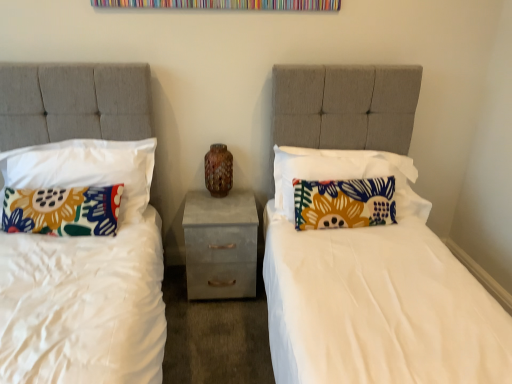
Question: Does brown speckled vase at center have a lesser height compared to floral fabric pillow at left, which is the 3th pillow from right to left?

Choices:
 (A) no
 (B) yes

Answer: (B)

Question: Is brown speckled vase at center taller than floral fabric pillow at left, which is the 3th pillow from right to left?

Choices:
 (A) yes
 (B) no

Answer: (B)

Question: From a real-world perspective, is brown speckled vase at center on top of floral fabric pillow at left, the second pillow viewed from the left?

Choices:
 (A) no
 (B) yes

Answer: (A)

Question: Is brown speckled vase at center oriented towards floral fabric pillow at left, the second pillow viewed from the left?

Choices:
 (A) no
 (B) yes

Answer: (A)

Question: Is brown speckled vase at center bigger than floral fabric pillow at left, which is the 3th pillow from right to left?

Choices:
 (A) no
 (B) yes

Answer: (A)

Question: Is brown speckled vase at center smaller than floral fabric pillow at left, the second pillow viewed from the left?

Choices:
 (A) yes
 (B) no

Answer: (A)

Question: Can you confirm if floral fabric pillow at right, the fourth pillow in the left-to-right sequence, is smaller than brown speckled vase at center?

Choices:
 (A) no
 (B) yes

Answer: (A)

Question: Does floral fabric pillow at right, the fourth pillow in the left-to-right sequence, have a greater width compared to brown speckled vase at center?

Choices:
 (A) no
 (B) yes

Answer: (B)

Question: Is floral fabric pillow at right, which appears as the 1th pillow when viewed from the right, facing towards brown speckled vase at center?

Choices:
 (A) yes
 (B) no

Answer: (B)

Question: From the image's perspective, is floral fabric pillow at right, the fourth pillow in the left-to-right sequence, located beneath brown speckled vase at center?

Choices:
 (A) no
 (B) yes

Answer: (B)

Question: Is floral fabric pillow at right, which appears as the 1th pillow when viewed from the right, with brown speckled vase at center?

Choices:
 (A) no
 (B) yes

Answer: (A)

Question: Considering the relative sizes of floral fabric pillow at right, the fourth pillow in the left-to-right sequence, and brown speckled vase at center in the image provided, is floral fabric pillow at right, the fourth pillow in the left-to-right sequence, taller than brown speckled vase at center?

Choices:
 (A) yes
 (B) no

Answer: (A)

Question: From a real-world perspective, is concrete textured nightstand at center below floral fabric pillow at right, which is counted as the 2th pillow, starting from the right?

Choices:
 (A) no
 (B) yes

Answer: (B)